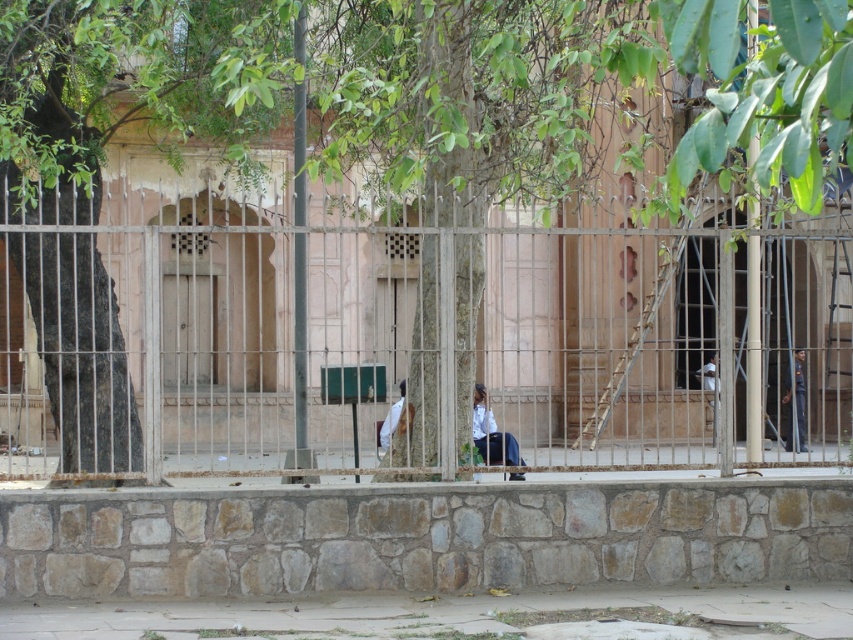
Can you confirm if metallic silver fence at center is bigger than white fabric at center?

Yes.

Is metallic silver fence at center taller than white fabric at center?

Indeed, metallic silver fence at center has a greater height compared to white fabric at center.

Between point (427, 285) and point (717, 376), which one is positioned in front?

Point (427, 285) is more forward.

Locate an element on the screen. metallic silver fence at center is located at coordinates coord(416,339).

This screenshot has width=853, height=640. I want to click on dark blue uniform at right, so click(x=795, y=403).

Can you confirm if dark blue uniform at right is thinner than white fabric at center?

Indeed, dark blue uniform at right has a lesser width compared to white fabric at center.

What do you see at coordinates (795, 403) in the screenshot? I see `dark blue uniform at right` at bounding box center [795, 403].

Locate an element on the screen. dark blue uniform at right is located at coordinates (795, 403).

Does white fabric shirt at center have a lesser height compared to dark blue uniform at right?

Yes.

Is point (480, 422) more distant than point (796, 355)?

No, it is not.

Is point (476, 429) closer to camera compared to point (787, 394)?

Yes, it is.

Locate an element on the screen. The image size is (853, 640). white fabric shirt at center is located at coordinates (491, 433).